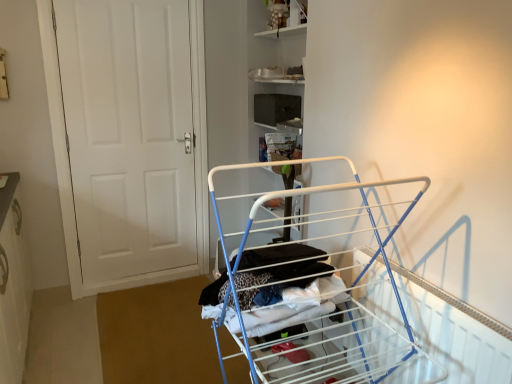
Question: From a real-world perspective, does metallic silver shelf at upper center stand above white matte door at left?

Choices:
 (A) no
 (B) yes

Answer: (B)

Question: From a real-world perspective, is metallic silver shelf at upper center under white matte door at left?

Choices:
 (A) yes
 (B) no

Answer: (B)

Question: Is metallic silver shelf at upper center smaller than white matte door at left?

Choices:
 (A) no
 (B) yes

Answer: (B)

Question: Is the depth of metallic silver shelf at upper center greater than that of white matte door at left?

Choices:
 (A) no
 (B) yes

Answer: (B)

Question: Is metallic silver shelf at upper center next to white matte door at left and touching it?

Choices:
 (A) no
 (B) yes

Answer: (A)

Question: In terms of size, does white matte door at left appear bigger or smaller than metallic silver shelf at upper center?

Choices:
 (A) small
 (B) big

Answer: (B)

Question: Is white matte door at left taller or shorter than metallic silver shelf at upper center?

Choices:
 (A) short
 (B) tall

Answer: (B)

Question: From the image's perspective, relative to metallic silver shelf at upper center, is white matte door at left above or below?

Choices:
 (A) above
 (B) below

Answer: (B)

Question: From a real-world perspective, relative to metallic silver shelf at upper center, is white matte door at left vertically above or below?

Choices:
 (A) below
 (B) above

Answer: (A)

Question: In the image, is metallic silver shelf at upper center on the left side or the right side of white metal drying rack at center?

Choices:
 (A) left
 (B) right

Answer: (A)

Question: Is metallic silver shelf at upper center in front of or behind white metal drying rack at center in the image?

Choices:
 (A) front
 (B) behind

Answer: (B)

Question: In terms of width, does metallic silver shelf at upper center look wider or thinner when compared to white metal drying rack at center?

Choices:
 (A) thin
 (B) wide

Answer: (A)

Question: Is point (305, 24) closer or farther from the camera than point (230, 258)?

Choices:
 (A) closer
 (B) farther

Answer: (B)

Question: In terms of width, does white matte door at left look wider or thinner when compared to white metal drying rack at center?

Choices:
 (A) thin
 (B) wide

Answer: (A)

Question: From the image's perspective, is white matte door at left positioned above or below white metal drying rack at center?

Choices:
 (A) above
 (B) below

Answer: (A)